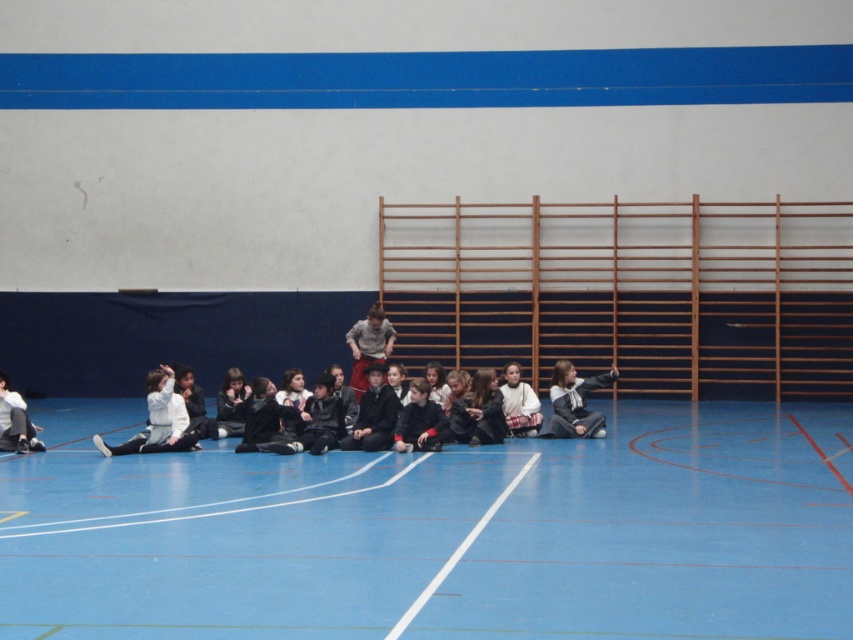
You are a photographer standing at the back of the gymnasium. You need to take a photo that includes both the blue rubber basketball court at lower center and the dark gray sweater at lower left. Considering their heights, will the basketball court be visible in the photo if you position yourself so that the sweater is at the front?

The blue rubber basketball court at lower center is not as tall as the dark gray sweater at lower left. Since the sweater is taller and placed in front, it may block the view of the basketball court in the photo.

You are a photographer taking a picture of the white matte jacket at lower left and the gray fabric shirt at center. Which clothing item should you zoom in on to make them appear the same size in the photo?

Since the white matte jacket at lower left is smaller than the gray fabric shirt at center, you should zoom in on the white matte jacket at lower left to make them appear the same size in the photo.

You are a photographer setting up a camera to capture the children in the gymnasium. You need to ensure that both the white matte jacket at lower left and the gray fabric shirt at center are clearly visible in the frame. Based on their positions and sizes, which object should you focus on first to ensure both are in focus?

The white matte jacket at lower left might be wider than gray fabric shirt at center, so focusing on the wider object first would help ensure both are in focus.